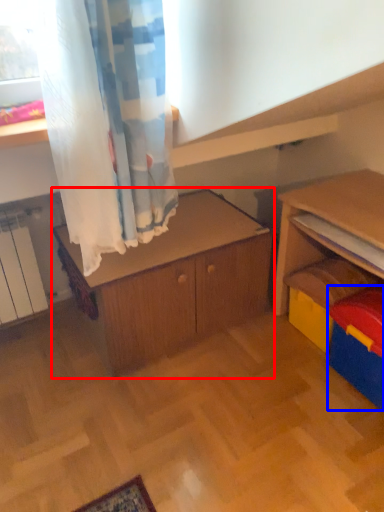
Question: Which object is closer to the camera taking this photo, cabinetry (highlighted by a red box) or storage box (highlighted by a blue box)?

Choices:
 (A) cabinetry
 (B) storage box

Answer: (B)